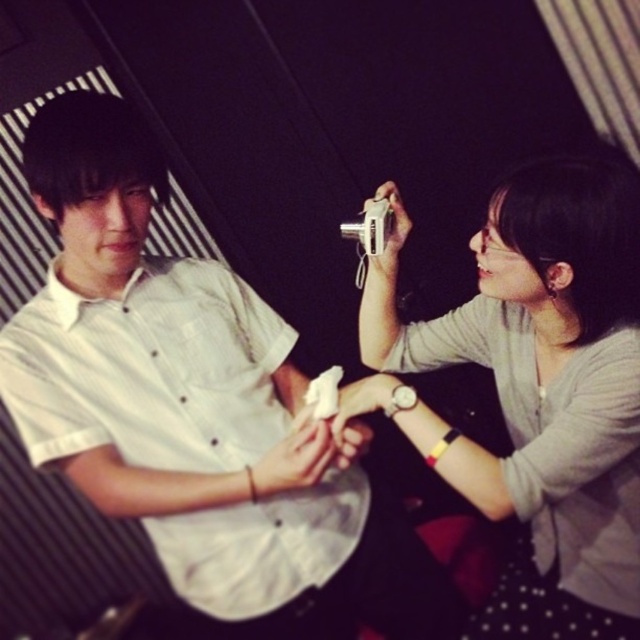
The height and width of the screenshot is (640, 640). Identify the location of white matte shirt at center. (170, 381).

I want to click on white matte shirt at center, so click(x=170, y=381).